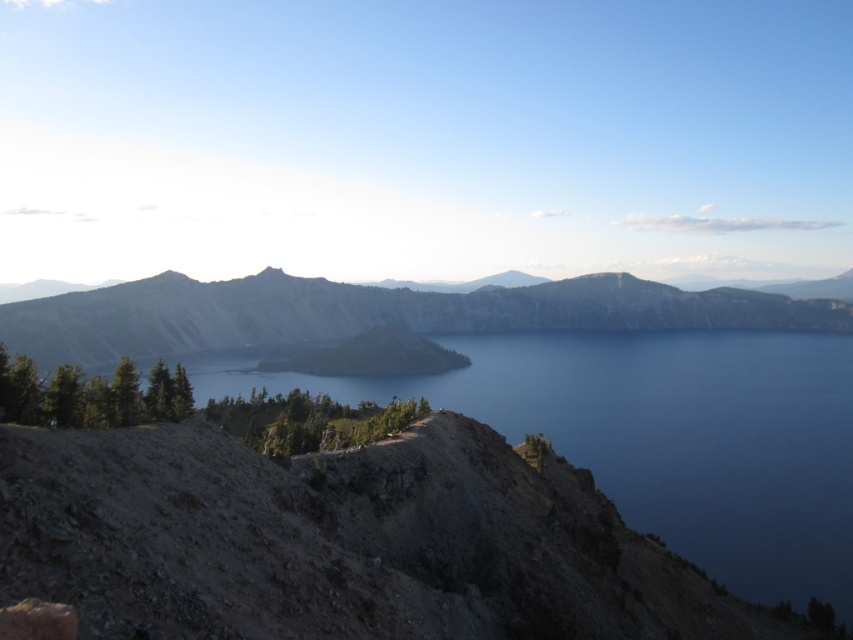
Question: Which of the following is the farthest from the observer?

Choices:
 (A) (268, 301)
 (B) (323, 385)

Answer: (A)

Question: Which of the following is the farthest from the observer?

Choices:
 (A) (461, 323)
 (B) (643, 490)

Answer: (A)

Question: Can you confirm if blue water at center is positioned below gray rocky mountain at center?

Choices:
 (A) no
 (B) yes

Answer: (B)

Question: Is blue water at center positioned before gray rocky mountain at center?

Choices:
 (A) no
 (B) yes

Answer: (B)

Question: Does blue water at center appear over gray rocky mountain at center?

Choices:
 (A) yes
 (B) no

Answer: (B)